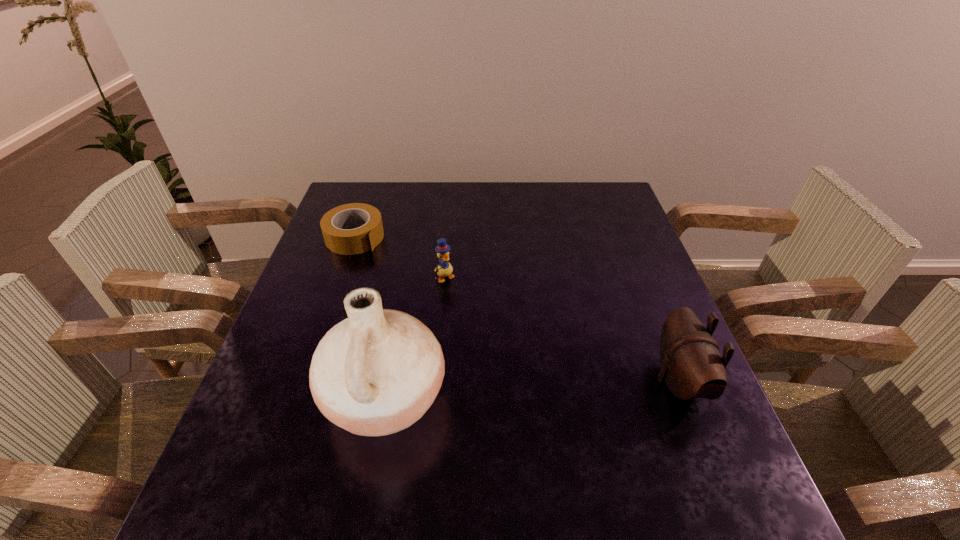
Where is `pottery`? Image resolution: width=960 pixels, height=540 pixels. pottery is located at coordinates (377, 372).

You are a GUI agent. You are given a task and a screenshot of the screen. Output one action in this format:
    pyautogui.click(x=<x>, y=<y>)
    Task: Click on the second tallest object
    
    Given the screenshot: What is the action you would take?
    pyautogui.click(x=691, y=365)

The image size is (960, 540). Find the location of `the rightmost object`. the rightmost object is located at coordinates (691, 365).

You are a GUI agent. You are given a task and a screenshot of the screen. Output one action in this format:
    pyautogui.click(x=<x>, y=<y>)
    Task: Click on the third tallest object
    
    Given the screenshot: What is the action you would take?
    pyautogui.click(x=444, y=269)

Image resolution: width=960 pixels, height=540 pixels. I want to click on the second farthest object, so click(x=444, y=269).

You are a GUI agent. You are given a task and a screenshot of the screen. Output one action in this format:
    pyautogui.click(x=<x>, y=<y>)
    Task: Click on the shortest object
    
    Given the screenshot: What is the action you would take?
    pyautogui.click(x=335, y=224)

Identify the location of the farthest object. (335, 224).

The height and width of the screenshot is (540, 960). Identify the location of free space located to pour from the handle of the tallest object. (284, 397).

The image size is (960, 540). In order to click on vacant space located 0.100m to pour from the handle of the tallest object in this screenshot , I will do `click(275, 397)`.

Where is `vacant area located to pour from the handle of the tallest object`? vacant area located to pour from the handle of the tallest object is located at coordinates (295, 397).